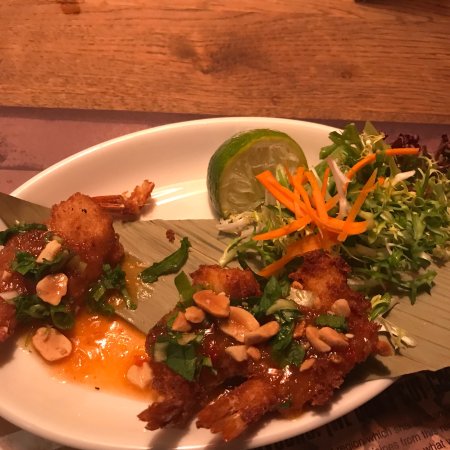
Image resolution: width=450 pixels, height=450 pixels. I want to click on wall, so click(223, 56).